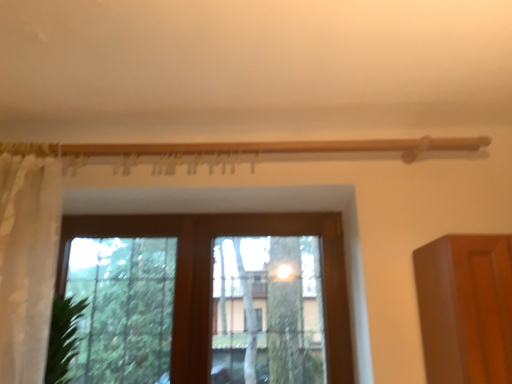
Describe the element at coordinates (27, 262) in the screenshot. I see `white sheer curtain at left` at that location.

Where is `white sheer curtain at left`? The width and height of the screenshot is (512, 384). white sheer curtain at left is located at coordinates (27, 262).

Image resolution: width=512 pixels, height=384 pixels. What do you see at coordinates (210, 278) in the screenshot? I see `brown wooden window at center` at bounding box center [210, 278].

Locate an element on the screen. brown wooden window at center is located at coordinates (210, 278).

Find the location of a particular element. white sheer curtain at left is located at coordinates (27, 262).

Between brown wooden window at center and white sheer curtain at left, which one appears on the left side from the viewer's perspective?

white sheer curtain at left.

Which object is more forward, brown wooden window at center or white sheer curtain at left?

white sheer curtain at left is more forward.

Does point (332, 306) come farther from viewer compared to point (49, 210)?

Yes, point (332, 306) is behind point (49, 210).

From the image's perspective, which is below, brown wooden window at center or white sheer curtain at left?

brown wooden window at center, from the image's perspective.

From a real-world perspective, which object rests below the other?

brown wooden window at center, from a real-world perspective.

Is brown wooden window at center wider or thinner than white sheer curtain at left?

In the image, brown wooden window at center appears to be more narrow than white sheer curtain at left.

Considering the relative sizes of brown wooden window at center and white sheer curtain at left in the image provided, is brown wooden window at center shorter than white sheer curtain at left?

Correct, brown wooden window at center is not as tall as white sheer curtain at left.

Looking at the image, does brown wooden window at center seem bigger or smaller compared to white sheer curtain at left?

Considering their sizes, brown wooden window at center takes up more space than white sheer curtain at left.

Is brown wooden window at center completely or partially outside of white sheer curtain at left?

Yes, brown wooden window at center is not within white sheer curtain at left.

Is there a large distance between brown wooden window at center and white sheer curtain at left?

That's not correct — brown wooden window at center is a little close to white sheer curtain at left.

From the picture: Does brown wooden window at center turn towards white sheer curtain at left?

Yes, brown wooden window at center faces towards white sheer curtain at left.

How many degrees apart are the facing directions of brown wooden window at center and white sheer curtain at left?

The angular difference between brown wooden window at center and white sheer curtain at left is 0.562 degrees.

You are a GUI agent. You are given a task and a screenshot of the screen. Output one action in this format:
    pyautogui.click(x=<x>, y=<y>)
    Task: Click on the curtain above the brown wooden window at center (from a real-world perspective)
    
    Given the screenshot: What is the action you would take?
    pyautogui.click(x=27, y=262)

Considering the relative positions of white sheer curtain at left and brown wooden window at center in the image provided, is white sheer curtain at left to the left of brown wooden window at center from the viewer's perspective?

Correct, you'll find white sheer curtain at left to the left of brown wooden window at center.

Consider the image. Which is in front, white sheer curtain at left or brown wooden window at center?

white sheer curtain at left is in front.

Considering the positions of points (1, 164) and (155, 228), is point (1, 164) closer to camera compared to point (155, 228)?

Yes, it is.

From the image's perspective, does white sheer curtain at left appear higher than brown wooden window at center?

Yes, from the image's perspective, white sheer curtain at left is on top of brown wooden window at center.

From a real-world perspective, is white sheer curtain at left positioned under brown wooden window at center based on gravity?

No.

Is white sheer curtain at left wider or thinner than brown wooden window at center?

In the image, white sheer curtain at left appears to be wider than brown wooden window at center.

Between white sheer curtain at left and brown wooden window at center, which one has less height?

Standing shorter between the two is brown wooden window at center.

Considering the sizes of objects white sheer curtain at left and brown wooden window at center in the image provided, who is smaller, white sheer curtain at left or brown wooden window at center?

white sheer curtain at left is smaller.

Is white sheer curtain at left located outside brown wooden window at center?

That's correct, white sheer curtain at left is outside of brown wooden window at center.

Does white sheer curtain at left touch brown wooden window at center?

No, white sheer curtain at left is not next to brown wooden window at center.

Is brown wooden window at center at the back of white sheer curtain at left?

Correct, white sheer curtain at left is looking away from brown wooden window at center.

How different are the orientations of white sheer curtain at left and brown wooden window at center in degrees?

The angle between the facing direction of white sheer curtain at left and the facing direction of brown wooden window at center is 0.562 degrees.

How far apart are white sheer curtain at left and brown wooden window at center?

24.33 inches.

Locate an element on the screen. Image resolution: width=512 pixels, height=384 pixels. window lying below the white sheer curtain at left (from the image's perspective) is located at coordinates (210, 278).

Locate an element on the screen. This screenshot has height=384, width=512. window that is on the right side of white sheer curtain at left is located at coordinates (210, 278).

The height and width of the screenshot is (384, 512). In order to click on window located behind the white sheer curtain at left in this screenshot , I will do `click(210, 278)`.